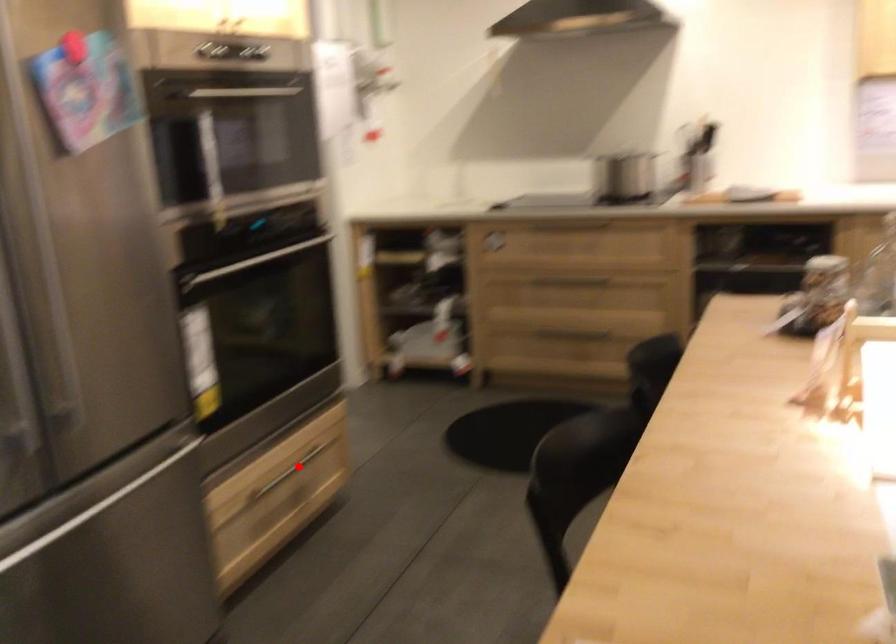
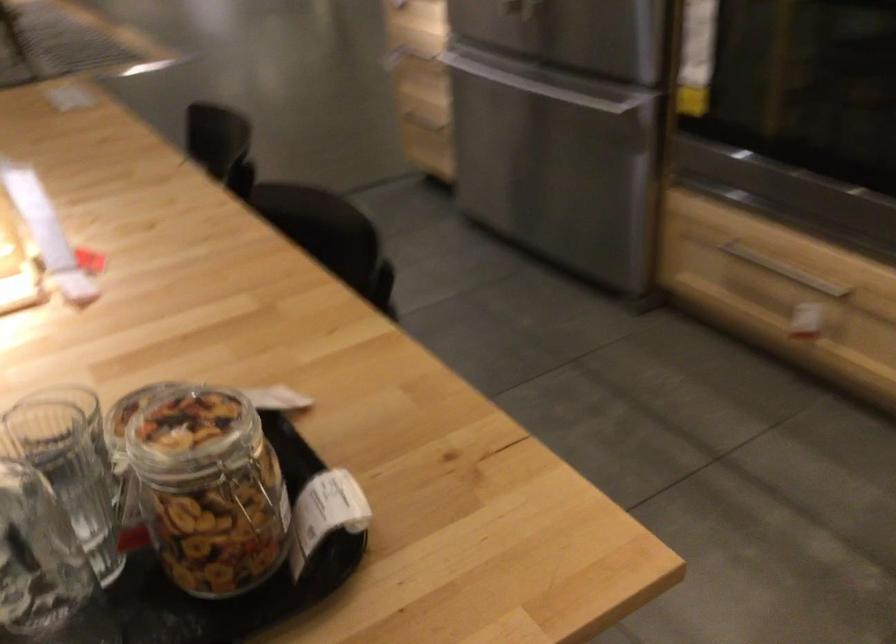
Locate, in the second image, the point that corresponds to the highlighted location in the first image.

(784, 270)